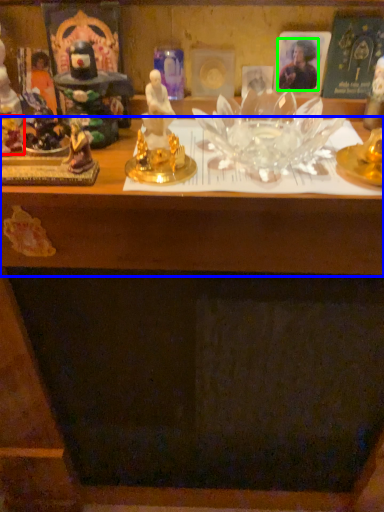
Question: Based on their relative distances, which object is nearer to toy (highlighted by a red box)? Choose from table (highlighted by a blue box) and person (highlighted by a green box).

Choices:
 (A) table
 (B) person

Answer: (A)